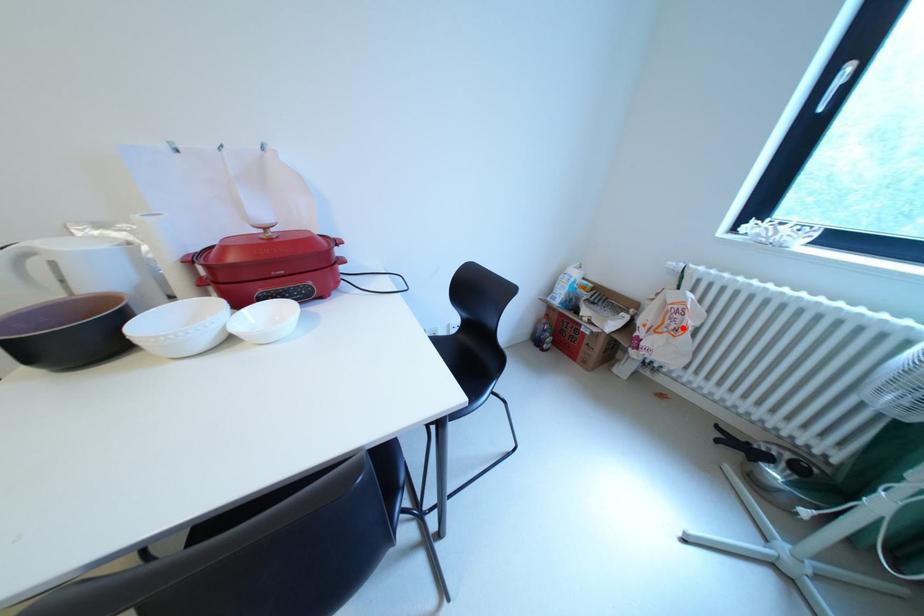
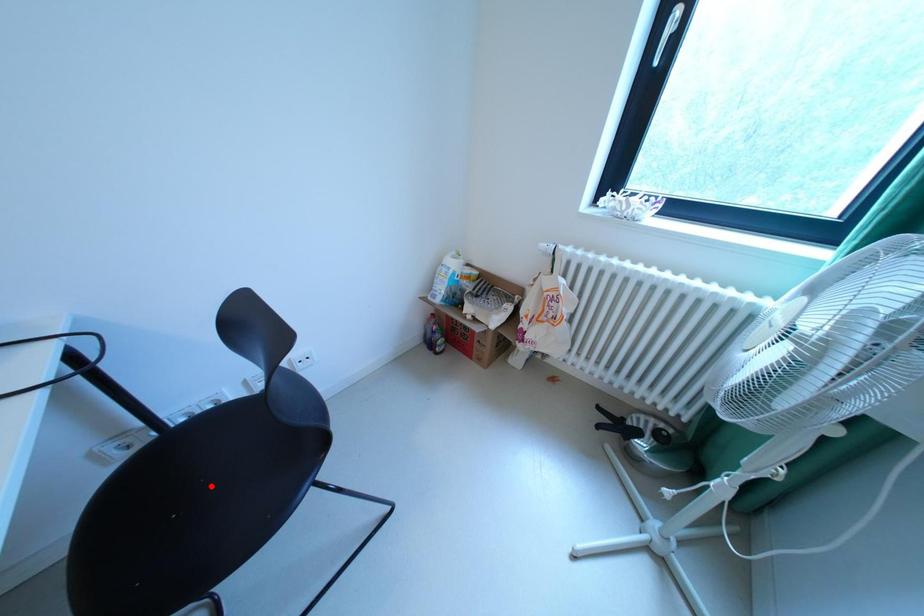
I am providing you with two images of the same scene from different viewpoints. A red point is marked on the first image and another point is marked on the second image. Is the red point in image1 aligned with the point shown in image2?

No